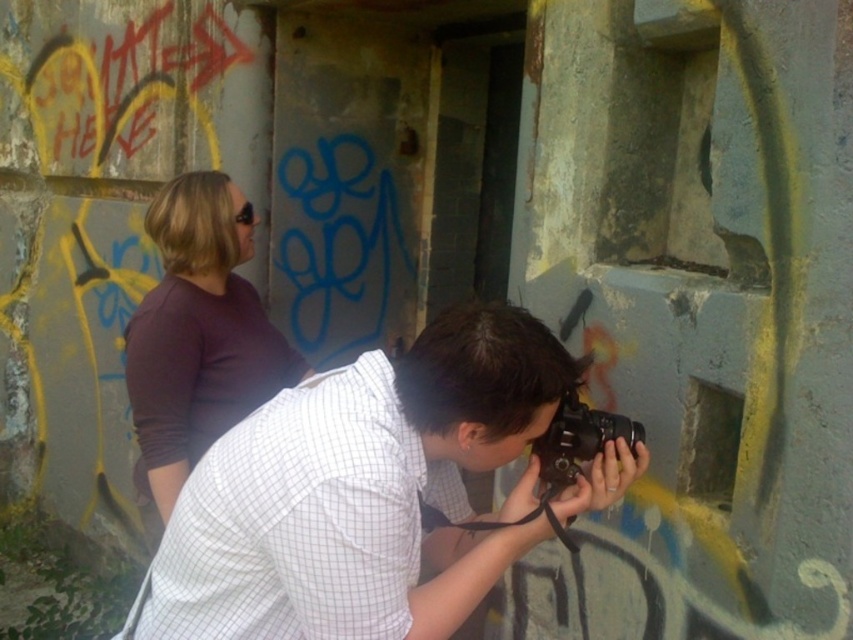
Between matte purple shirt at upper left and black plastic camera at center, which one appears on the right side from the viewer's perspective?

black plastic camera at center

Who is taller, matte purple shirt at upper left or black plastic camera at center?

With more height is matte purple shirt at upper left.

Between point (302, 356) and point (564, 406), which one is positioned in front?

Positioned in front is point (564, 406).

At what (x,y) coordinates should I click in order to perform the action: click on matte purple shirt at upper left. Please return your answer as a coordinate pair (x, y). The width and height of the screenshot is (853, 640). Looking at the image, I should click on (198, 333).

Which is more to the right, white checkered shirt at center or black plastic camera at center?

Positioned to the right is black plastic camera at center.

Is point (190, 627) farther from camera compared to point (606, 412)?

No, (190, 627) is closer to viewer.

Locate an element on the screen. white checkered shirt at center is located at coordinates (361, 492).

Between white checkered shirt at center and matte purple shirt at upper left, which one has more height?

matte purple shirt at upper left is taller.

Does white checkered shirt at center have a greater width compared to matte purple shirt at upper left?

Indeed, white checkered shirt at center has a greater width compared to matte purple shirt at upper left.

Where is `white checkered shirt at center`? white checkered shirt at center is located at coordinates (361, 492).